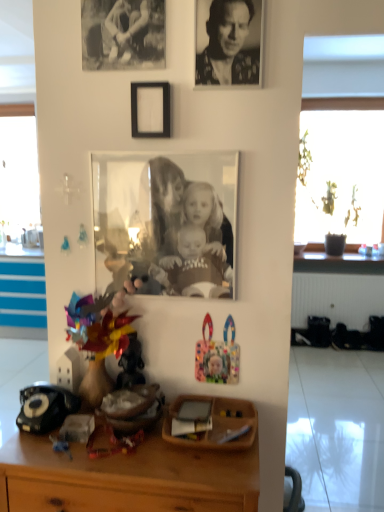
Question: Is wooden desk at center to the left or to the right of multicolored plastic toy at lower center, which appears as the 3th toy when viewed from the left, in the image?

Choices:
 (A) left
 (B) right

Answer: (A)

Question: From a real-world perspective, is wooden desk at center above or below multicolored plastic toy at lower center, which is the first toy in right-to-left order?

Choices:
 (A) below
 (B) above

Answer: (A)

Question: Estimate the real-world distances between objects in this image. Which object is farther from the black paper at upper left, which appears as the 1th picture frame when viewed from the top?

Choices:
 (A) shiny metallic figurine at center, marked as the second toy in a right-to-left arrangement
 (B) black matte picture frame at upper center, the 2th picture frame from the bottom
 (C) shiny metallic toy at center, acting as the first toy starting from the left
 (D) matte glass photo frame at center, positioned as the third picture frame in top-to-bottom order
 (E) wooden desk at center

Answer: (E)

Question: Based on their relative distances, which object is nearer to the shiny metallic toy at center, acting as the first toy starting from the left?

Choices:
 (A) wooden desk at center
 (B) matte glass photo frame at center, positioned as the third picture frame in top-to-bottom order
 (C) shiny metallic figurine at center, the 2th toy in the left-to-right sequence
 (D) black textured photo at upper center
 (E) multicolored plastic toy at lower center, which is the first toy in right-to-left order

Answer: (C)